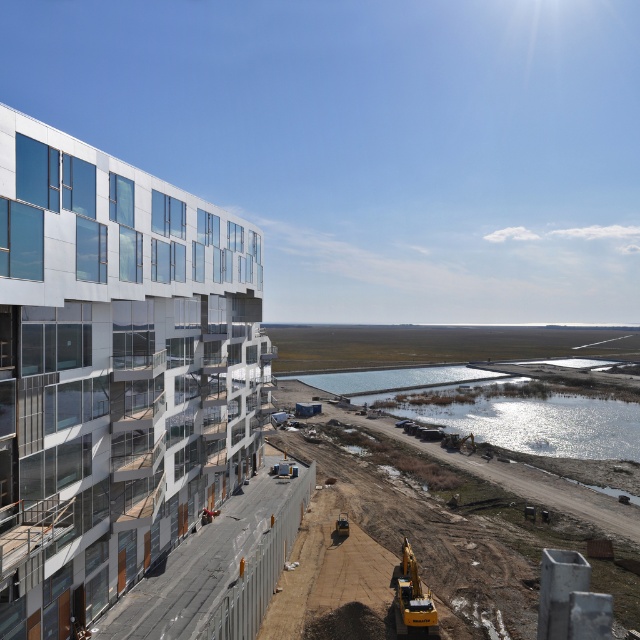
You are standing at the construction site near the building and want to take a photo. There are two points marked in the image, point 1 at coordinates point (36, 259) and point 2 at coordinates point (596, 440). If you want to focus on the point closer to you, which coordinate should you aim your camera at?

Point (36, 259) is closer to the camera than point (596, 440), so you should aim your camera at point (36, 259) to focus on the closer point.

You are standing at the construction site near the building and want to take a photo. There are two points marked in the image, point 1 at coordinates point (200, 477) and point 2 at coordinates point (426, 596). Which point is closer to your camera position?

Point (200, 477) is further to the camera than point (426, 596), so the point closer to your camera position is point (426, 596).